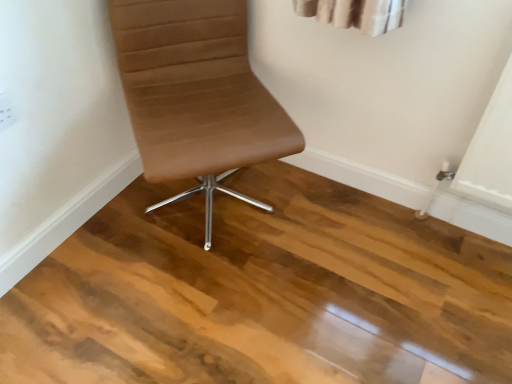
Find the location of a particular element. The height and width of the screenshot is (384, 512). vacant region to the left of brown leather chair at center is located at coordinates (97, 238).